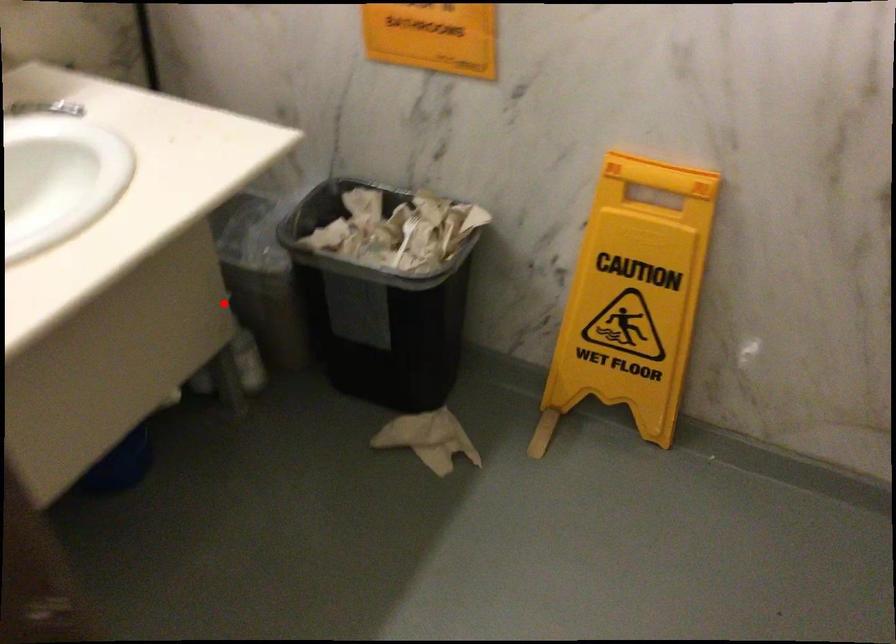
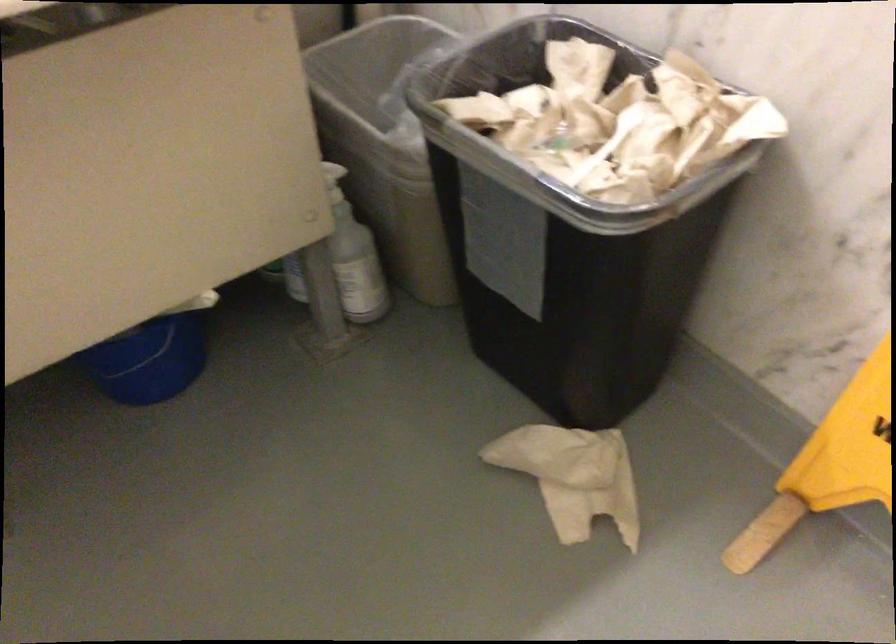
Question: I am providing you with two images of the same scene from different viewpoints. In image1, a red point is highlighted. Considering the same 3D point in image2, which of the following is correct?

Choices:
 (A) It is closer
 (B) It is farther

Answer: (A)